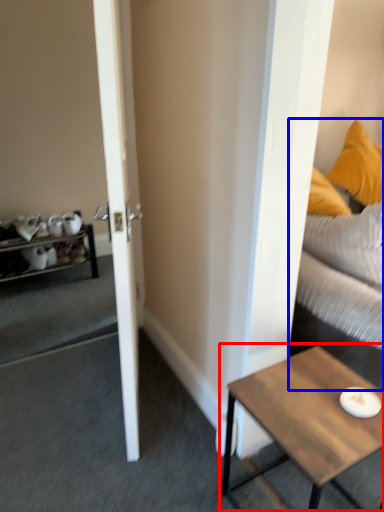
Question: Which point is further to the camera, coffee table (highlighted by a red box) or studio couch (highlighted by a blue box)?

Choices:
 (A) coffee table
 (B) studio couch

Answer: (B)